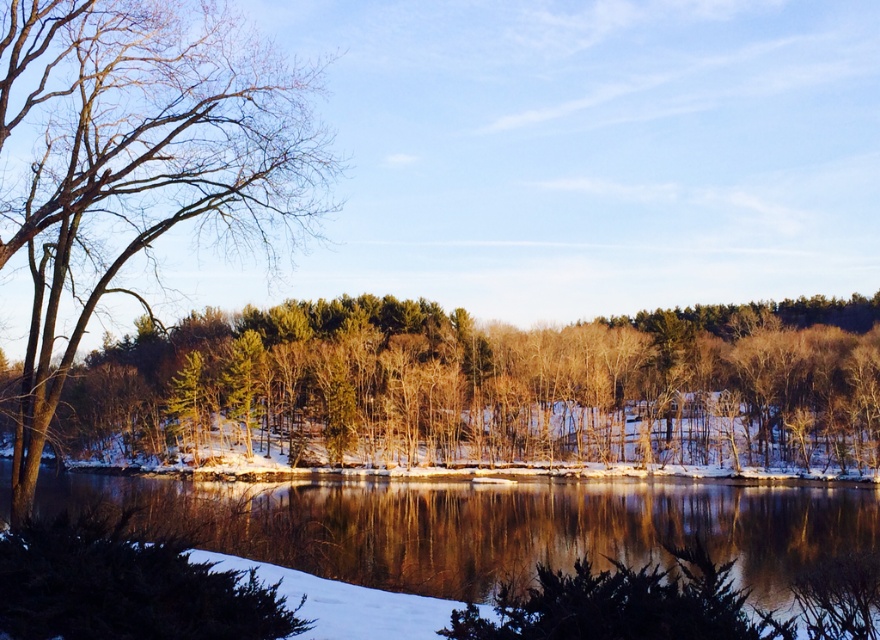
Question: Which point is farther from the camera taking this photo?

Choices:
 (A) (144, 532)
 (B) (204, 364)

Answer: (B)

Question: Where is bare branches at left located in relation to glossy reflective water at center in the image?

Choices:
 (A) right
 (B) left

Answer: (B)

Question: Is bare branches at left positioned in front of glossy reflective water at center?

Choices:
 (A) yes
 (B) no

Answer: (B)

Question: Estimate the real-world distances between objects in this image. Which object is farther from the bare branches at left?

Choices:
 (A) glossy reflective water at center
 (B) green matte tree at center

Answer: (B)

Question: Can you confirm if green matte tree at center is positioned to the right of bare branches at left?

Choices:
 (A) no
 (B) yes

Answer: (B)

Question: Which object is the closest to the green matte tree at center?

Choices:
 (A) glossy reflective water at center
 (B) bare branches at left

Answer: (A)